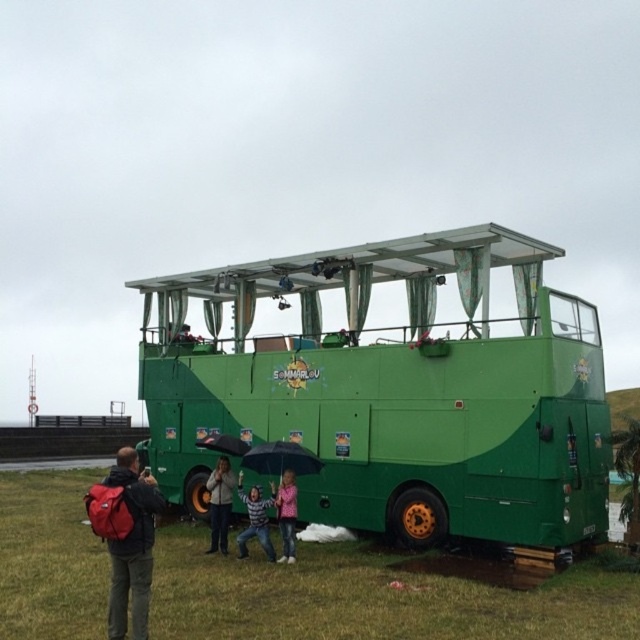
Which is behind, point (292, 502) or point (196, 442)?

The point (196, 442) is behind.

Does pink fabric jacket at center appear over black matte umbrella at lower center?

Actually, pink fabric jacket at center is below black matte umbrella at lower center.

Which is behind, point (292, 513) or point (212, 433)?

Point (212, 433)

At what (x,y) coordinates should I click in order to perform the action: click on pink fabric jacket at center. Please return your answer as a coordinate pair (x, y). Looking at the image, I should click on (285, 515).

Consider the image. Who is more forward, (392,627) or (284,483)?

Positioned in front is point (392,627).

Can you confirm if green grass at lower left is smaller than pink fabric jacket at center?

No.

Is point (65, 609) closer to camera compared to point (285, 520)?

Yes, it is in front of point (285, 520).

Where is `green grass at lower left`? green grass at lower left is located at coordinates (378, 595).

Is green grass at lower left to the left of black matte umbrella at lower center from the viewer's perspective?

Yes, green grass at lower left is to the left of black matte umbrella at lower center.

Is green grass at lower left taller than black matte umbrella at lower center?

Indeed, green grass at lower left has a greater height compared to black matte umbrella at lower center.

You are a GUI agent. You are given a task and a screenshot of the screen. Output one action in this format:
    pyautogui.click(x=<x>, y=<y>)
    Task: Click on the green grass at lower left
    
    Given the screenshot: What is the action you would take?
    pyautogui.click(x=378, y=595)

Find the location of a particular element. green grass at lower left is located at coordinates (378, 595).